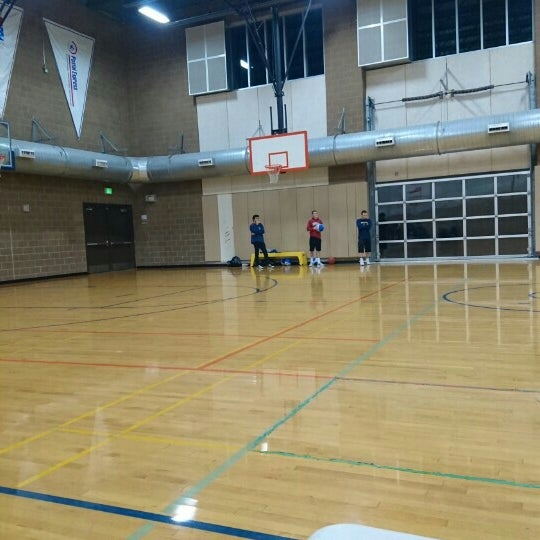
Identify the location of wall banners. The image size is (540, 540). (77, 87), (14, 24).